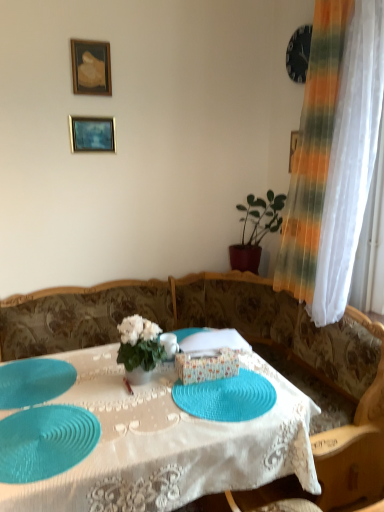
Where is `free region under teal rubber placemat at lower left, positioned as the 2th glass plate in left-to-right order (from a real-world perspective)`? Image resolution: width=384 pixels, height=512 pixels. free region under teal rubber placemat at lower left, positioned as the 2th glass plate in left-to-right order (from a real-world perspective) is located at coordinates (47, 437).